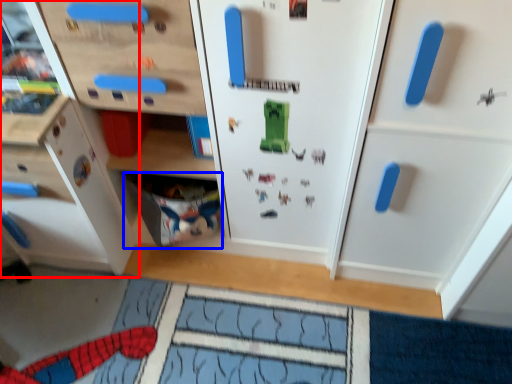
Question: Which object appears closest to the camera in this image, cabinetry (highlighted by a red box) or drawer (highlighted by a blue box)?

Choices:
 (A) cabinetry
 (B) drawer

Answer: (A)